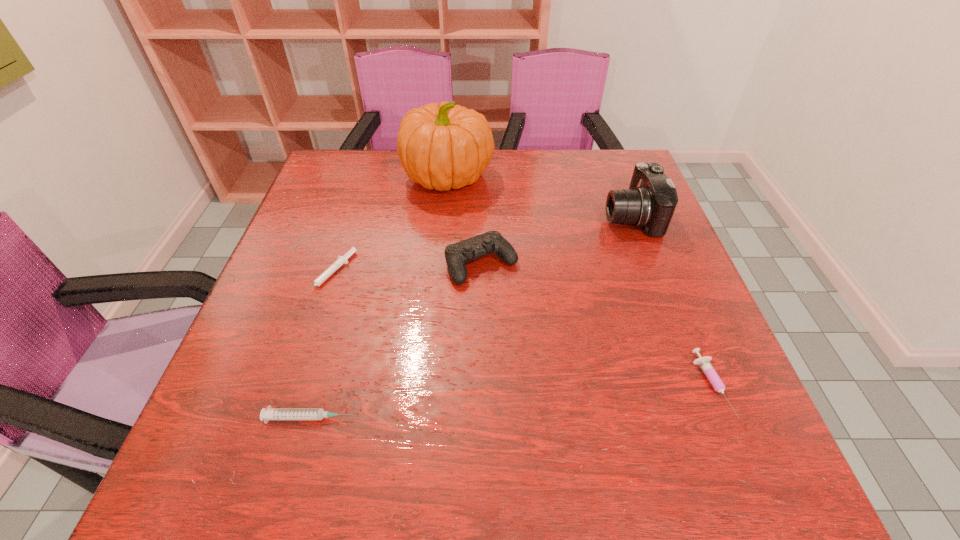
Identify the location of pumpkin. This screenshot has width=960, height=540. (441, 146).

Find the location of a particular element. This screenshot has width=960, height=540. the fifth shortest object is located at coordinates (650, 202).

The width and height of the screenshot is (960, 540). Find the location of `the fourth shortest object`. the fourth shortest object is located at coordinates (458, 254).

The width and height of the screenshot is (960, 540). What are the coordinates of `the rightmost syringe` in the screenshot? It's located at (704, 362).

This screenshot has width=960, height=540. Identify the location of the shortest object. (337, 264).

I want to click on the farthest syringe, so click(x=337, y=264).

Find the location of a particular element. The height and width of the screenshot is (540, 960). vacant space located 0.080m on the surface of the pumpkin is located at coordinates (521, 176).

Image resolution: width=960 pixels, height=540 pixels. In order to click on free location located 0.070m on the lens of the camera in this screenshot , I will do `click(577, 217)`.

Locate an element on the screen. vacant area situated 0.310m on the lens of the camera is located at coordinates (484, 217).

Where is `free space located on the lens of the camera`? free space located on the lens of the camera is located at coordinates (495, 217).